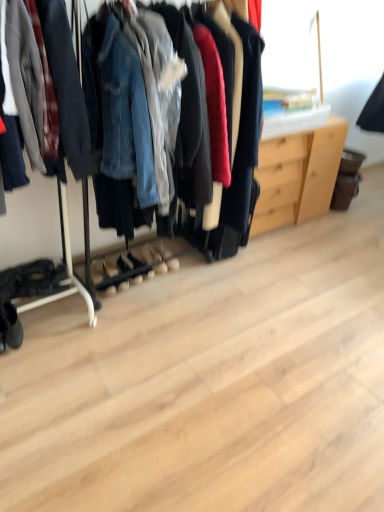
In order to face black suede boot at lower left, should I rotate leftwards or rightwards?

You should rotate left by 24.898 degrees.

Describe the element at coordinates (10, 327) in the screenshot. I see `black suede boot at lower left` at that location.

I want to click on black suede boot at lower left, so click(x=10, y=327).

Describe the element at coordinates (298, 175) in the screenshot. This screenshot has width=384, height=512. I see `light wood dresser at center` at that location.

Where is `light wood dresser at center`? The width and height of the screenshot is (384, 512). light wood dresser at center is located at coordinates (298, 175).

Identify the location of black suede boot at lower left. (10, 327).

Is light wood dresser at center at the right side of black suede boot at lower left?

Indeed, light wood dresser at center is positioned on the right side of black suede boot at lower left.

In the image, is light wood dresser at center positioned in front of or behind black suede boot at lower left?

Clearly, light wood dresser at center is behind black suede boot at lower left.

Which is closer, (331, 139) or (8, 334)?

The point (8, 334) is in front.

From the image's perspective, is light wood dresser at center located above or below black suede boot at lower left?

From the image's perspective, light wood dresser at center appears above black suede boot at lower left.

From a real-world perspective, which is physically below, light wood dresser at center or black suede boot at lower left?

black suede boot at lower left, from a real-world perspective.

Does light wood dresser at center have a lesser width compared to black suede boot at lower left?

No, light wood dresser at center is not thinner than black suede boot at lower left.

Which of these two, light wood dresser at center or black suede boot at lower left, stands taller?

light wood dresser at center.

Between light wood dresser at center and black suede boot at lower left, which one has larger size?

light wood dresser at center.

Is light wood dresser at center inside the boundaries of black suede boot at lower left, or outside?

light wood dresser at center is outside black suede boot at lower left.

Is there a large distance between light wood dresser at center and black suede boot at lower left?

light wood dresser at center is positioned a significant distance from black suede boot at lower left.

Is light wood dresser at center oriented away from black suede boot at lower left?

light wood dresser at center does not have its back to black suede boot at lower left.

From the picture: How different are the orientations of light wood dresser at center and black suede boot at lower left in degrees?

There is a 0.084-degree angle between the facing directions of light wood dresser at center and black suede boot at lower left.

I want to click on dresser behind the black suede boot at lower left, so click(x=298, y=175).

In the image, is black suede boot at lower left on the left side or the right side of light wood dresser at center?

black suede boot at lower left is to the left of light wood dresser at center.

Is black suede boot at lower left closer to camera compared to light wood dresser at center?

Yes, the depth of black suede boot at lower left is less than that of light wood dresser at center.

Between point (7, 305) and point (330, 143), which one is positioned in front?

The point (7, 305) is more forward.

From the image's perspective, is black suede boot at lower left on top of light wood dresser at center?

Incorrect, from the image's perspective, black suede boot at lower left is lower than light wood dresser at center.

From a real-world perspective, who is located lower, black suede boot at lower left or light wood dresser at center?

black suede boot at lower left.

Considering the sizes of objects black suede boot at lower left and light wood dresser at center in the image provided, who is wider, black suede boot at lower left or light wood dresser at center?

light wood dresser at center.

Considering the sizes of black suede boot at lower left and light wood dresser at center in the image, is black suede boot at lower left taller or shorter than light wood dresser at center?

In the image, black suede boot at lower left appears to be shorter than light wood dresser at center.

Is black suede boot at lower left bigger than light wood dresser at center?

No, black suede boot at lower left is not bigger than light wood dresser at center.

Is light wood dresser at center a part of black suede boot at lower left?

No, light wood dresser at center is not a part of black suede boot at lower left.

In the scene shown: Is black suede boot at lower left positioned far away from light wood dresser at center?

Yes, black suede boot at lower left and light wood dresser at center are located far from each other.

Is black suede boot at lower left oriented away from light wood dresser at center?

black suede boot at lower left is not turned away from light wood dresser at center.

What's the angular difference between black suede boot at lower left and light wood dresser at center's facing directions?

The angle between the facing direction of black suede boot at lower left and the facing direction of light wood dresser at center is 0.084 degrees.

How much distance is there between black suede boot at lower left and light wood dresser at center?

6.25 feet.

This screenshot has width=384, height=512. Identify the location of footwear below the light wood dresser at center (from the image's perspective). (10, 327).

In order to click on dresser that is behind the black suede boot at lower left in this screenshot , I will do `click(298, 175)`.

The width and height of the screenshot is (384, 512). I want to click on footwear that is below the light wood dresser at center (from the image's perspective), so click(x=10, y=327).